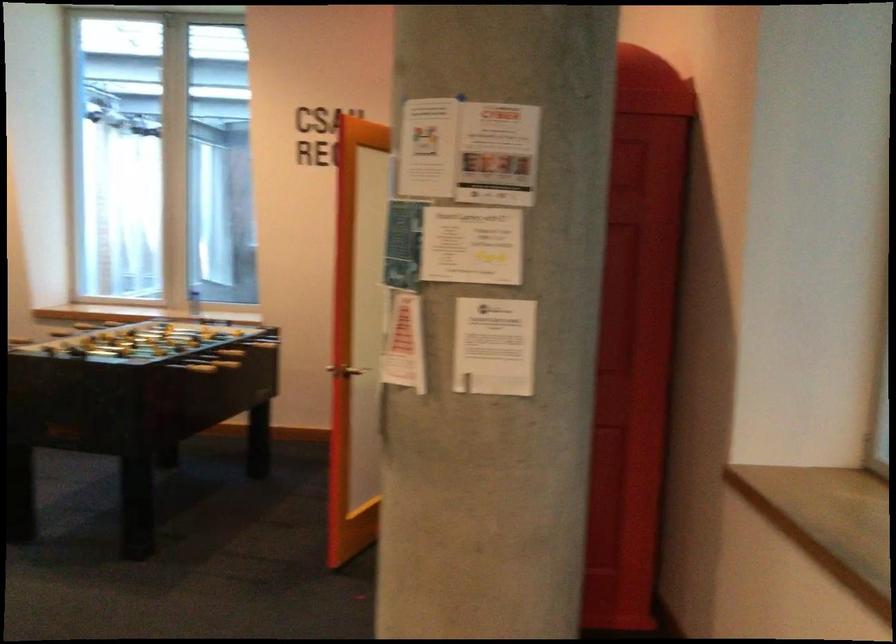
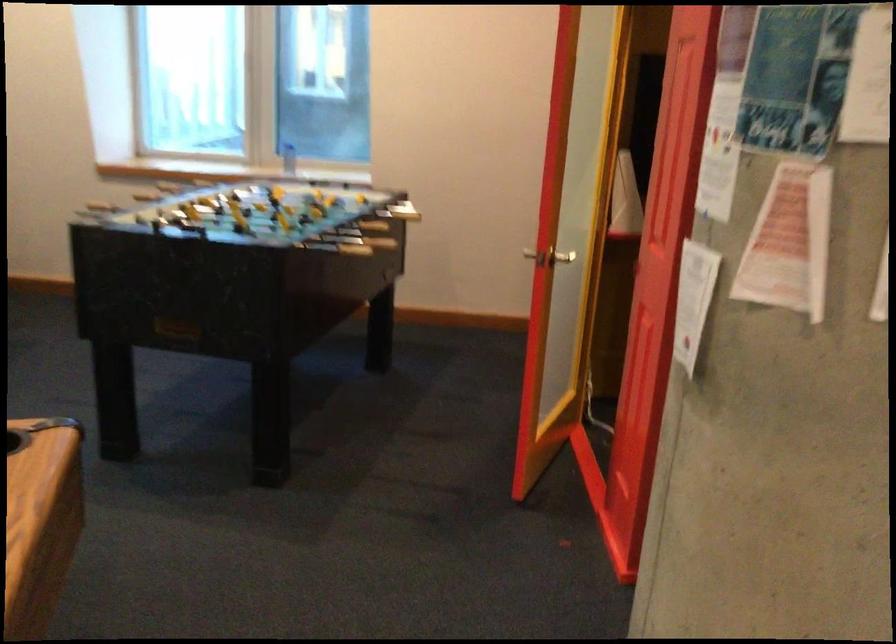
The point at (192, 363) is marked in the first image. Where is the corresponding point in the second image?

(339, 248)